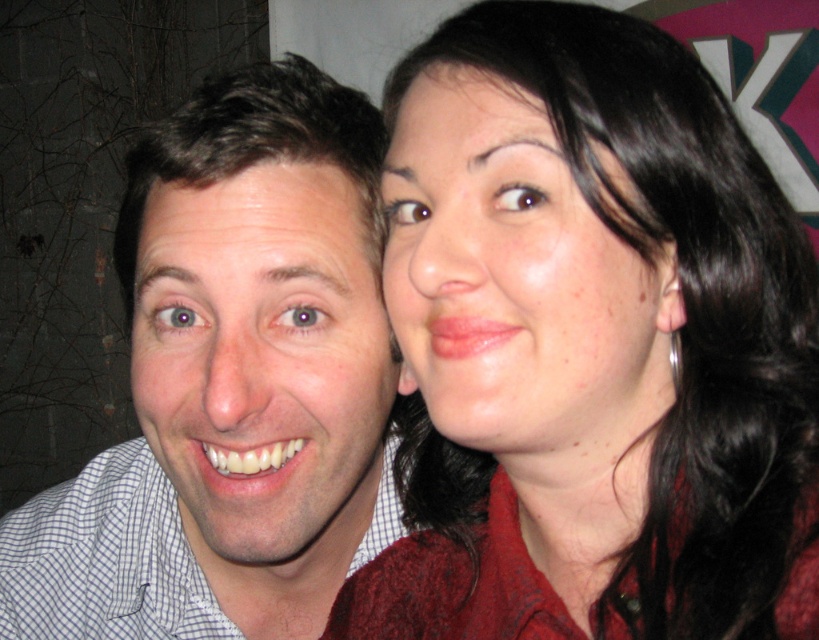
Is white matte face at center shorter than silver metallic ring at ear?

Incorrect, white matte face at center's height does not fall short of silver metallic ring at ear's.

Which is more to the right, white matte face at center or silver metallic ring at ear?

From the viewer's perspective, silver metallic ring at ear appears more on the right side.

What do you see at coordinates (263, 362) in the screenshot? I see `white matte face at center` at bounding box center [263, 362].

At what (x,y) coordinates should I click in order to perform the action: click on white matte face at center. Please return your answer as a coordinate pair (x, y). The height and width of the screenshot is (640, 819). Looking at the image, I should click on (263, 362).

Between point (562, 445) and point (66, 500), which one is positioned in front?

Point (562, 445) is more forward.

Does matte red sweater at upper right have a lesser width compared to white checkered shirt at left?

Indeed, matte red sweater at upper right has a lesser width compared to white checkered shirt at left.

Is point (688, 490) in front of point (127, 160)?

Yes, point (688, 490) is closer to viewer.

The image size is (819, 640). Identify the location of matte red sweater at upper right. (590, 346).

Is point (134, 362) in front of point (448, 221)?

No, (134, 362) is behind (448, 221).

Between white checkered shirt at left and matte skin face at upper right, which one appears on the right side from the viewer's perspective?

Positioned to the right is matte skin face at upper right.

The image size is (819, 640). Describe the element at coordinates (232, 381) in the screenshot. I see `white checkered shirt at left` at that location.

Where is `white checkered shirt at left`? Image resolution: width=819 pixels, height=640 pixels. white checkered shirt at left is located at coordinates (232, 381).